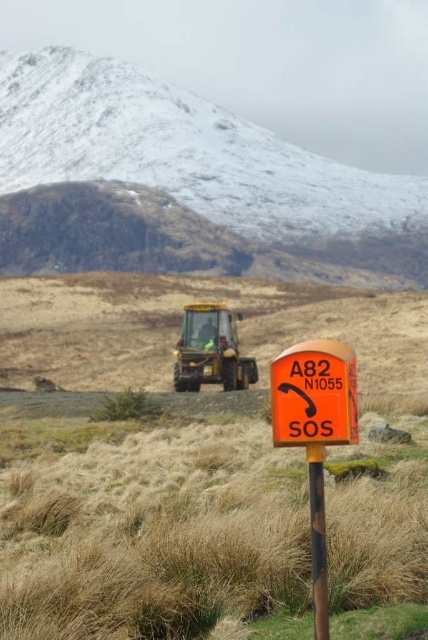
Does orange matte/solid sos at lower right lie behind yellow metallic tractor at center?

No, it is in front of yellow metallic tractor at center.

Consider the image. Can you confirm if orange matte/solid sos at lower right is taller than yellow metallic tractor at center?

Indeed, orange matte/solid sos at lower right has a greater height compared to yellow metallic tractor at center.

Is point (297, 413) closer to viewer compared to point (229, 308)?

Yes.

Where is `orange matte/solid sos at lower right`? orange matte/solid sos at lower right is located at coordinates (315, 432).

Does orange plastic sign at lower right come in front of brown wood post at center?

No, orange plastic sign at lower right is behind brown wood post at center.

Does orange plastic sign at lower right have a larger size compared to brown wood post at center?

Indeed, orange plastic sign at lower right has a larger size compared to brown wood post at center.

Is point (320, 355) positioned before point (324, 540)?

No, (320, 355) is further to viewer.

Find the location of a particular element. This screenshot has height=640, width=428. orange plastic sign at lower right is located at coordinates (315, 394).

Does orange plastic sign at lower right lie behind yellow metallic tractor at center?

No.

What do you see at coordinates (315, 394) in the screenshot?
I see `orange plastic sign at lower right` at bounding box center [315, 394].

Does point (302, 352) come in front of point (187, 358)?

Yes, point (302, 352) is in front of point (187, 358).

The width and height of the screenshot is (428, 640). In order to click on orange plastic sign at lower right in this screenshot , I will do click(315, 394).